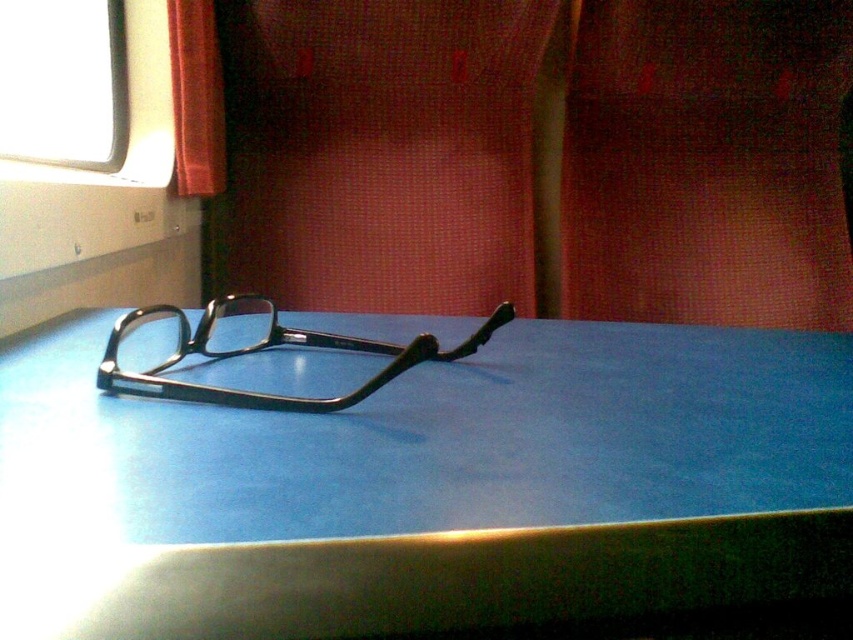
Which is behind, point (787, 92) or point (219, 346)?

Point (787, 92)

Identify the location of matte red curtain at upper center. (706, 163).

Is point (721, 227) in front of point (218, 67)?

No, (721, 227) is further to viewer.

Does matte red curtain at upper center appear over matte red curtain at upper left?

No.

The image size is (853, 640). What are the coordinates of `matte red curtain at upper center` in the screenshot? It's located at (706, 163).

Is matte red curtain at center positioned in front of matte red curtain at upper center?

Yes, it is in front of matte red curtain at upper center.

Can you confirm if matte red curtain at center is smaller than matte red curtain at upper center?

Yes, matte red curtain at center is smaller than matte red curtain at upper center.

Identify the location of matte red curtain at center. This screenshot has width=853, height=640. (381, 150).